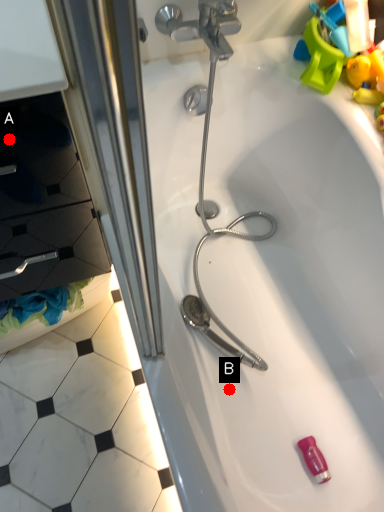
Question: Two points are circled on the image, labeled by A and B beside each circle. Which point is further to the camera?

Choices:
 (A) A is further
 (B) B is further

Answer: (B)